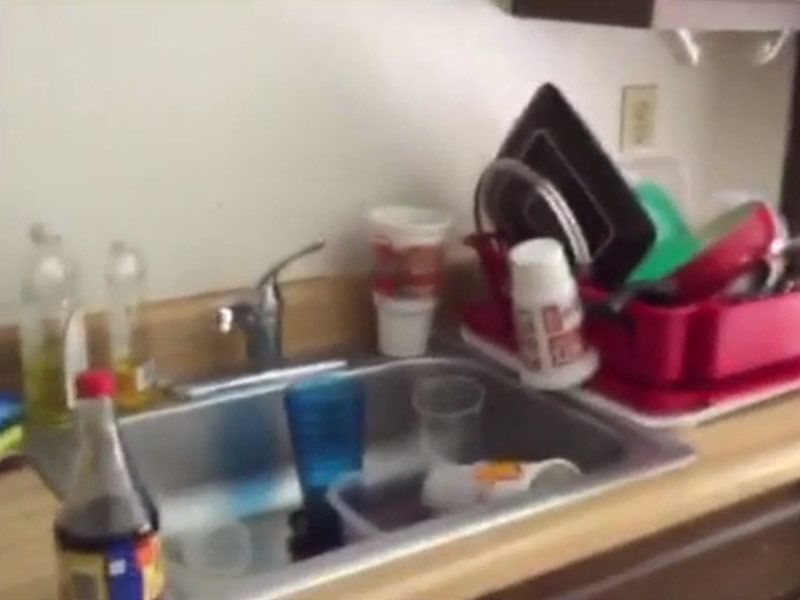
The width and height of the screenshot is (800, 600). What are the coordinates of `electrical outlet` in the screenshot? It's located at (634, 101).